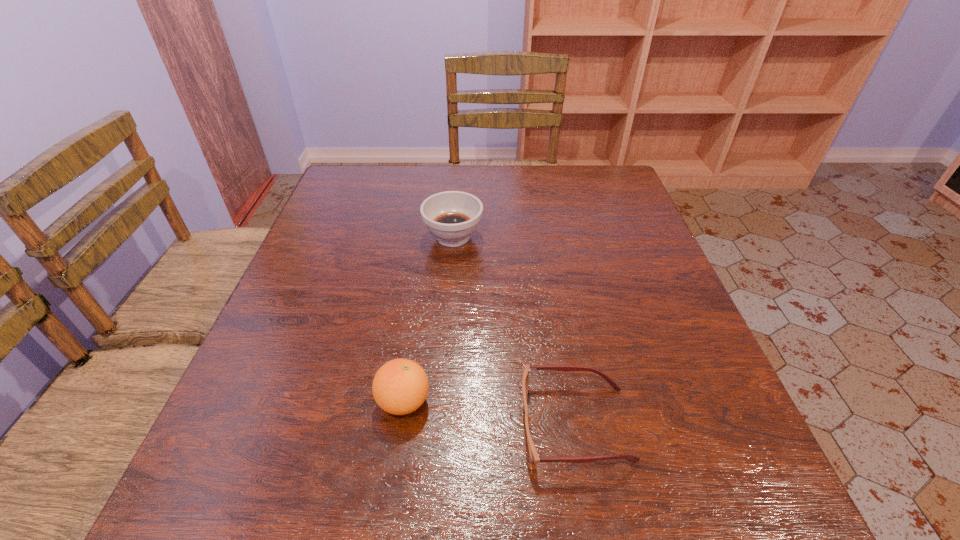
Identify the location of the farthest object. The height and width of the screenshot is (540, 960). (452, 216).

Where is `orange`? The width and height of the screenshot is (960, 540). orange is located at coordinates (400, 386).

Locate an element on the screen. This screenshot has width=960, height=540. the shortest object is located at coordinates (535, 457).

The width and height of the screenshot is (960, 540). Identify the location of spectacles. (535, 457).

Identify the location of vacant space located on the left of the farthest object. The image size is (960, 540). (399, 237).

At what (x,y) coordinates should I click in order to perform the action: click on vacant area located on the back of the orange. Please return your answer as a coordinate pair (x, y). This screenshot has height=540, width=960. Looking at the image, I should click on (420, 291).

Image resolution: width=960 pixels, height=540 pixels. In order to click on free space located on the front-facing side of the shortest object in this screenshot , I will do `click(358, 424)`.

Find the location of a particular element. This screenshot has width=960, height=540. vacant space located on the front-facing side of the shortest object is located at coordinates (285, 424).

You are a GUI agent. You are given a task and a screenshot of the screen. Output one action in this format:
    pyautogui.click(x=<x>, y=<y>)
    Task: Click on the free point located 0.190m on the front-facing side of the shortest object
    
    Given the screenshot: What is the action you would take?
    pyautogui.click(x=406, y=424)

Where is `object that is at the near edge`? object that is at the near edge is located at coordinates (535, 457).